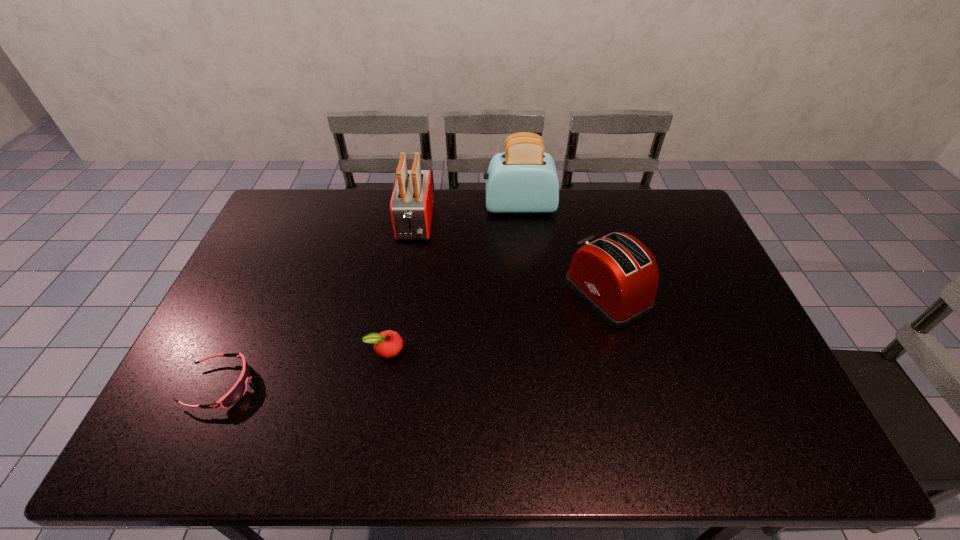
At what (x,y) coordinates should I click in order to perform the action: click on object that is at the left edge. Please return your answer as a coordinate pair (x, y). Looking at the image, I should click on (238, 390).

Where is `free space at the far edge of the desktop`? free space at the far edge of the desktop is located at coordinates (462, 195).

Find the location of `vacant space at the near edge of the desktop`. vacant space at the near edge of the desktop is located at coordinates (238, 451).

In the image, there is a desktop. Identify the location of free space at the left edge. This screenshot has height=540, width=960. (223, 359).

I want to click on vacant space at the right edge, so click(673, 230).

This screenshot has width=960, height=540. I want to click on free space at the far left corner of the desktop, so click(x=315, y=195).

Image resolution: width=960 pixels, height=540 pixels. Find the location of `vacant point located between the third farthest object and the goggles`. vacant point located between the third farthest object and the goggles is located at coordinates (414, 340).

At what (x,y) coordinates should I click in order to perform the action: click on free space between the third tallest object and the leftmost object. Please return your answer as a coordinate pair (x, y). The width and height of the screenshot is (960, 540). Looking at the image, I should click on (414, 340).

I want to click on free space between the leftmost toaster and the shortest object, so click(x=318, y=305).

Find the location of a particular element. This screenshot has height=540, width=960. free space between the fourth tallest object and the leftmost toaster is located at coordinates (400, 286).